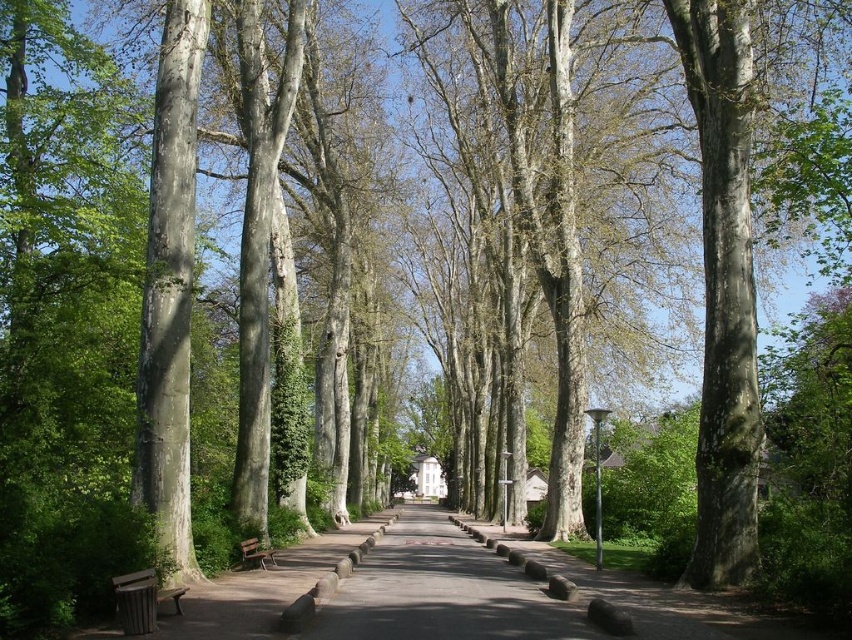
You are standing at the entrance of the park and see the wooden bench at lower left and the wooden park bench at center. Which bench is closer to you?

The wooden bench at lower left is closer to the viewer than the wooden park bench at center.

You are standing at the point marked as point [141,600] in the park scene. According to the image, what object are you currently positioned on?

The point [141,600] is on the wooden bench at lower left, so you are positioned on the wooden bench at lower left.

You are a person who wants to sit on the lowest bench in the park. Which bench should you choose between the wooden bench at lower left and the wooden park bench at center?

The wooden bench at lower left has a lesser height compared to the wooden park bench at center, so you should choose the wooden bench at lower left.